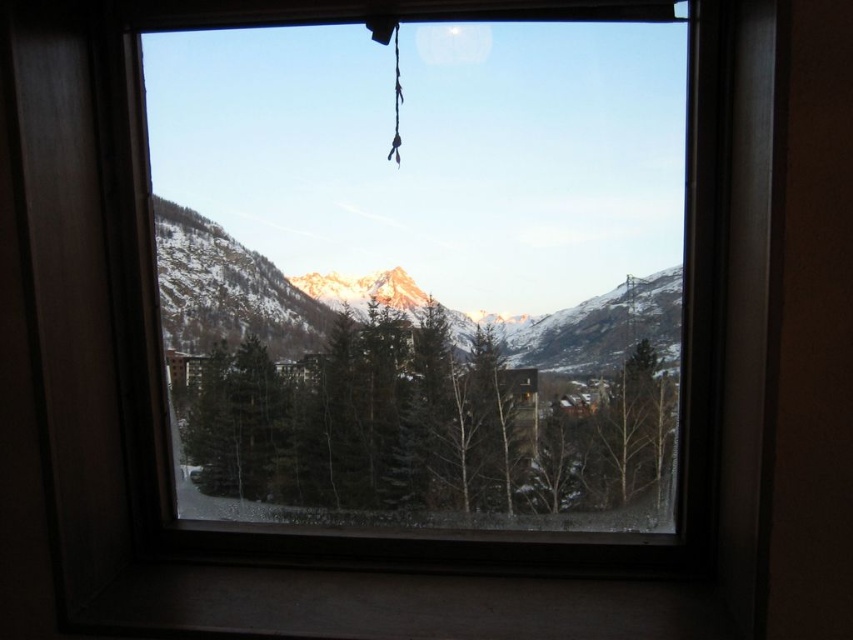
Who is positioned more to the right, green matte tree at center or snowy mountain at center?

Positioned to the right is green matte tree at center.

Is green matte tree at center shorter than snowy mountain at center?

No.

At what (x,y) coordinates should I click in order to perform the action: click on green matte tree at center. Please return your answer as a coordinate pair (x, y). The image size is (853, 640). Looking at the image, I should click on (434, 426).